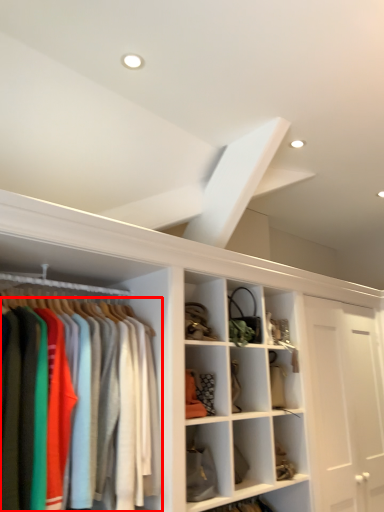
Question: From the image's perspective, where is clothing (annotated by the red box) located relative to exhaust hood?

Choices:
 (A) above
 (B) below

Answer: (B)